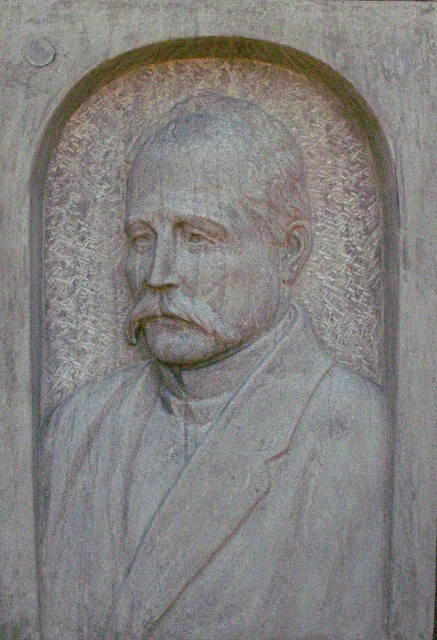
Question: Does gray stone bust at center have a greater width compared to gray stone face at center?

Choices:
 (A) yes
 (B) no

Answer: (A)

Question: Can you confirm if gray stone bust at center is positioned below gray stone face at center?

Choices:
 (A) no
 (B) yes

Answer: (B)

Question: Which object is farther from the camera taking this photo?

Choices:
 (A) gray stone face at center
 (B) gray stone bust at center

Answer: (B)

Question: Can you confirm if gray stone bust at center is positioned above gray stone face at center?

Choices:
 (A) no
 (B) yes

Answer: (A)